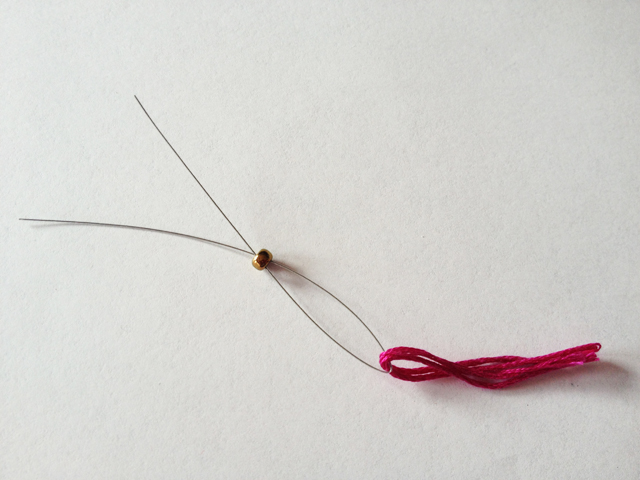
The width and height of the screenshot is (640, 480). I want to click on table, so click(x=400, y=214).